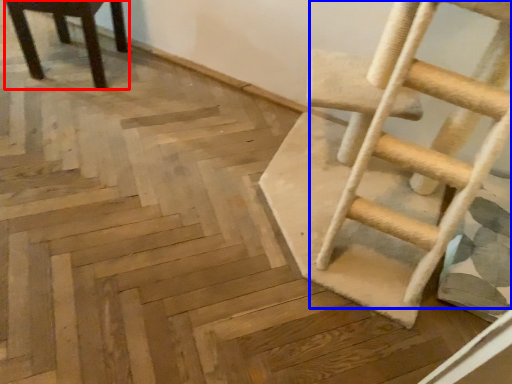
Question: Among these objects, which one is farthest to the camera, chair (highlighted by a red box) or ladder (highlighted by a blue box)?

Choices:
 (A) chair
 (B) ladder

Answer: (A)